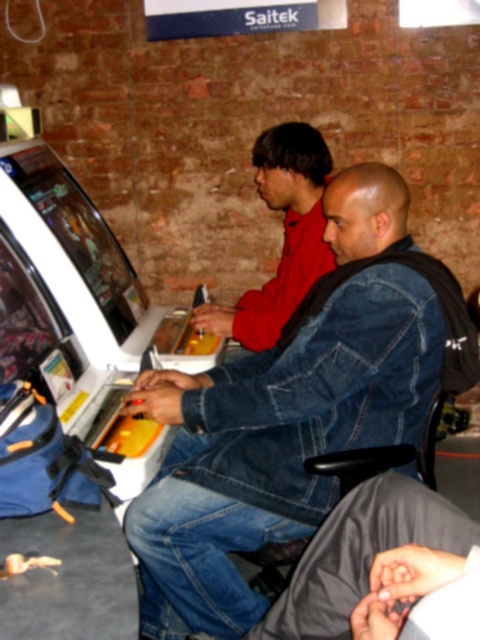
Question: Among these points, which one is farthest from the camera?

Choices:
 (A) (278, 316)
 (B) (231, 588)

Answer: (A)

Question: Among these points, which one is farthest from the camera?

Choices:
 (A) [262, 483]
 (B) [325, 145]

Answer: (B)

Question: Is denim jacket at center above red matte shirt at center?

Choices:
 (A) yes
 (B) no

Answer: (B)

Question: Does denim jacket at center have a lesser width compared to red matte shirt at center?

Choices:
 (A) yes
 (B) no

Answer: (B)

Question: From the image, what is the correct spatial relationship of denim jacket at center in relation to red matte shirt at center?

Choices:
 (A) above
 (B) below

Answer: (B)